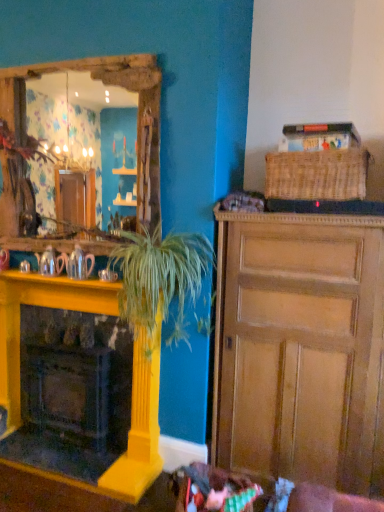
Question: From a real-world perspective, relative to wooden cabinet at right, is woven brown picnic basket at upper right vertically above or below?

Choices:
 (A) above
 (B) below

Answer: (A)

Question: Considering the positions of woven brown picnic basket at upper right and wooden cabinet at right in the image, is woven brown picnic basket at upper right bigger or smaller than wooden cabinet at right?

Choices:
 (A) small
 (B) big

Answer: (A)

Question: Based on their relative distances, which object is nearer to the green leafy plant at center?

Choices:
 (A) woven brown picnic basket at upper right
 (B) matte silver coffee cup at lower left
 (C) wooden cabinet at center
 (D) wooden cabinet at right
 (E) matte silver teapot at left, arranged as the second teapot when viewed from the left

Answer: (B)

Question: Estimate the real-world distances between objects in this image. Which object is closer to the matte silver coffee cup at lower left?

Choices:
 (A) woven brown picnic basket at upper right
 (B) wooden cabinet at center
 (C) matte silver teapot at left, arranged as the second teapot when viewed from the left
 (D) green leafy plant at center
 (E) wooden cabinet at right

Answer: (C)